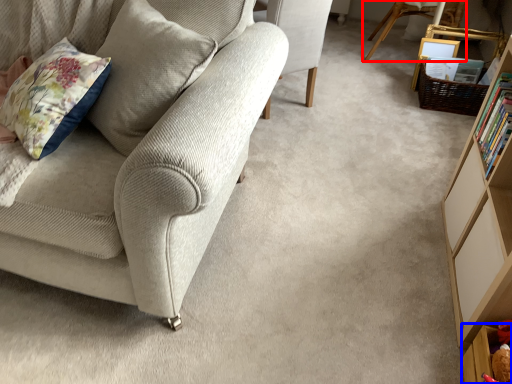
Question: Among these objects, which one is nearest to the camera, chair (highlighted by a red box) or shelf (highlighted by a blue box)?

Choices:
 (A) chair
 (B) shelf

Answer: (B)